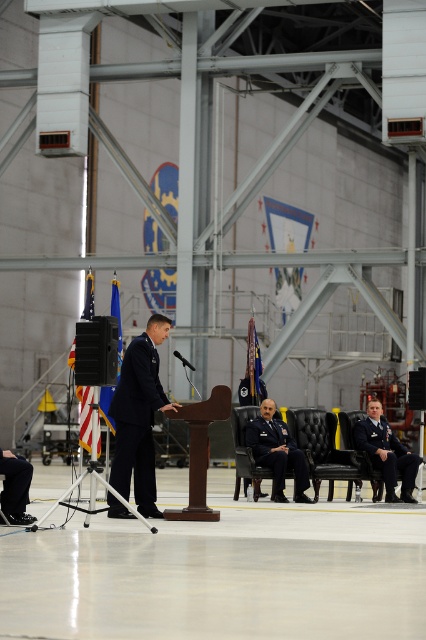
Does point (402, 484) come closer to viewer compared to point (17, 506)?

No, it is behind (17, 506).

Who is more distant from viewer, (397, 499) or (9, 493)?

Positioned behind is point (397, 499).

Find the location of a particular element. black matte uniform at lower right is located at coordinates (386, 452).

Does dark blue fabric uniform at center appear on the left side of black matte uniform at lower right?

Correct, you'll find dark blue fabric uniform at center to the left of black matte uniform at lower right.

Looking at this image, can you confirm if dark blue fabric uniform at center is shorter than black matte uniform at lower right?

No.

The image size is (426, 640). Identify the location of dark blue fabric uniform at center. (278, 454).

At what (x,y) coordinates should I click in order to perform the action: click on dark blue fabric uniform at center. Please return your answer as a coordinate pair (x, y). The image size is (426, 640). Looking at the image, I should click on (278, 454).

Identify the location of navy blue fabric uniform at center. This screenshot has height=640, width=426. (138, 420).

Which is more to the left, navy blue fabric uniform at center or black matte uniform at lower right?

From the viewer's perspective, navy blue fabric uniform at center appears more on the left side.

Who is more forward, (167, 326) or (394, 465)?

Point (167, 326) is in front.

Image resolution: width=426 pixels, height=640 pixels. In order to click on navy blue fabric uniform at center in this screenshot , I will do `click(138, 420)`.